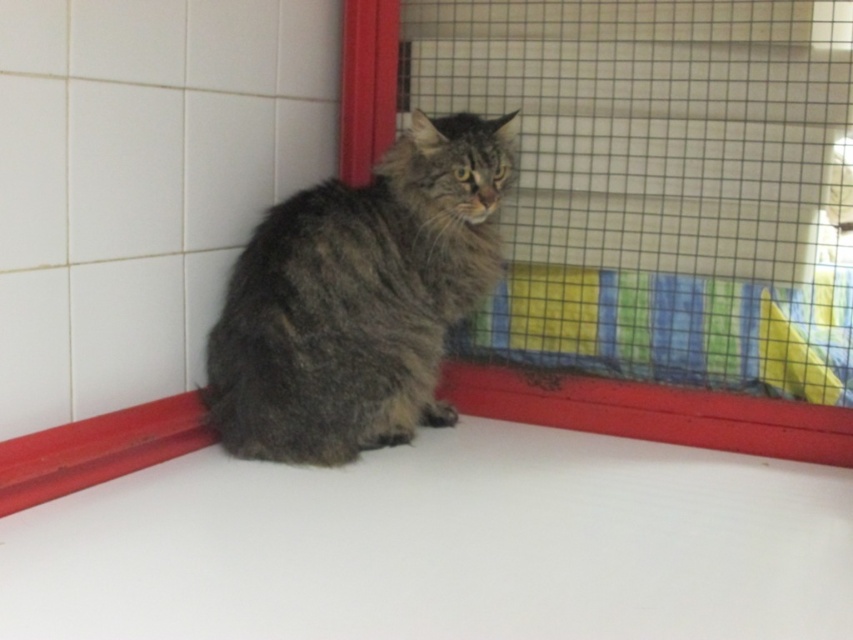
You are a veterinarian examining the gray fluffy cat at center in its enclosure. The soft mesh cage at center has a height requirement for animal safety. Based on the cat, do you think the cage meets the safety standard?

The gray fluffy cat at center is much taller than the soft mesh cage at center, which means the cage is not tall enough to safely accommodate the cat. The cat could potentially hurt itself or feel cramped in such a small enclosure.

You are a veterinarian examining a gray fluffy cat at center inside a soft mesh cage at center. Can the cat fit through the gaps in the cage? Explain your answer based on the cat and cage sizes.

The gray fluffy cat at center has a lesser width compared to the soft mesh cage at center. Since the cat is narrower than the cage, it might be able to fit through the gaps, but the cage is designed to prevent escape, so it should be secure. However, the description only mentions the cat being narrower, not the specific gap size. Without knowing the gap size, we can only assume the cage is appropriately sized for the cat.

You are a visitor at a petting zoo and see the gray fluffy cat at center and the soft mesh cage at center. Which object is nearer to you?

The gray fluffy cat at center is closer to the viewer than the soft mesh cage at center.